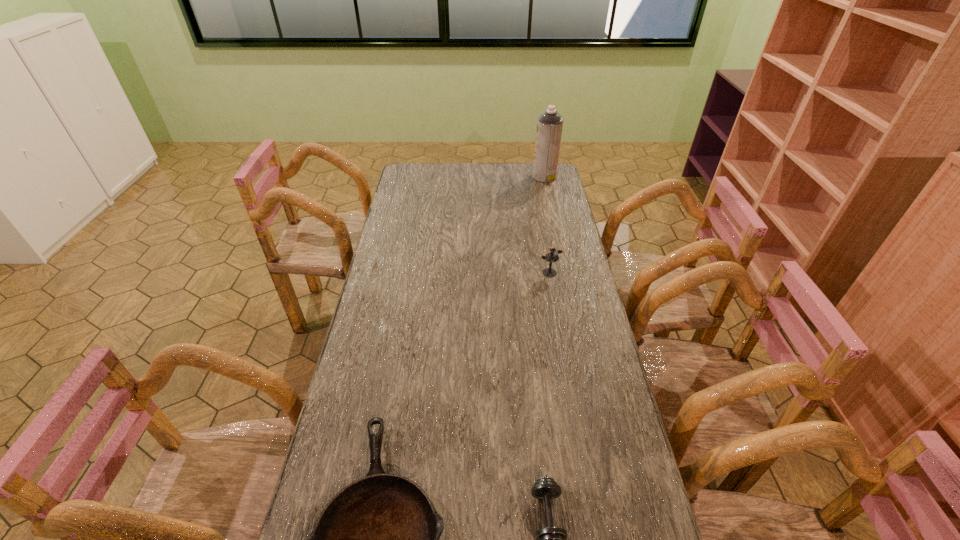
Locate an element on the screen. The height and width of the screenshot is (540, 960). the tallest object is located at coordinates (550, 123).

This screenshot has height=540, width=960. I want to click on the farthest object, so click(550, 123).

Find the location of a particular element. This screenshot has height=540, width=960. candle holder is located at coordinates (551, 257).

Image resolution: width=960 pixels, height=540 pixels. What are the coordinates of `the third nearest object` in the screenshot? It's located at (551, 257).

Find the location of `free point located on the left of the tallest object`. free point located on the left of the tallest object is located at coordinates (501, 177).

The width and height of the screenshot is (960, 540). I want to click on vacant area situated 0.340m on the left of the second farthest object, so click(x=446, y=273).

The height and width of the screenshot is (540, 960). I want to click on object that is positioned at the far edge, so click(550, 123).

At what (x,y) coordinates should I click in order to perform the action: click on aerosol can that is at the right edge. Please return your answer as a coordinate pair (x, y). This screenshot has width=960, height=540. Looking at the image, I should click on (550, 123).

You are a GUI agent. You are given a task and a screenshot of the screen. Output one action in this format:
    pyautogui.click(x=<x>, y=<y>)
    Task: Click on the candle holder situated at the right edge
    This screenshot has width=960, height=540.
    Given the screenshot: What is the action you would take?
    pyautogui.click(x=551, y=257)

Locate an element on the screen. object positioned at the far right corner is located at coordinates (550, 123).